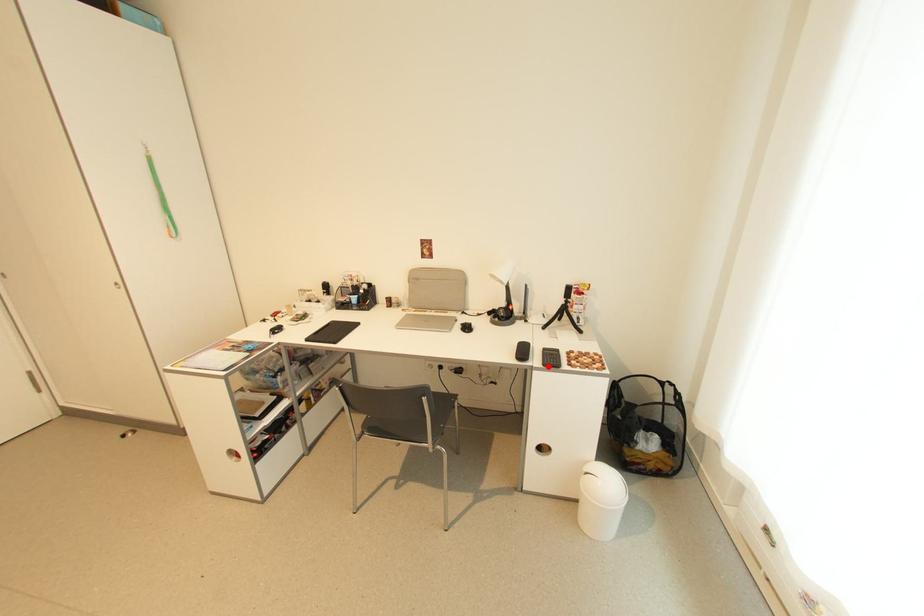
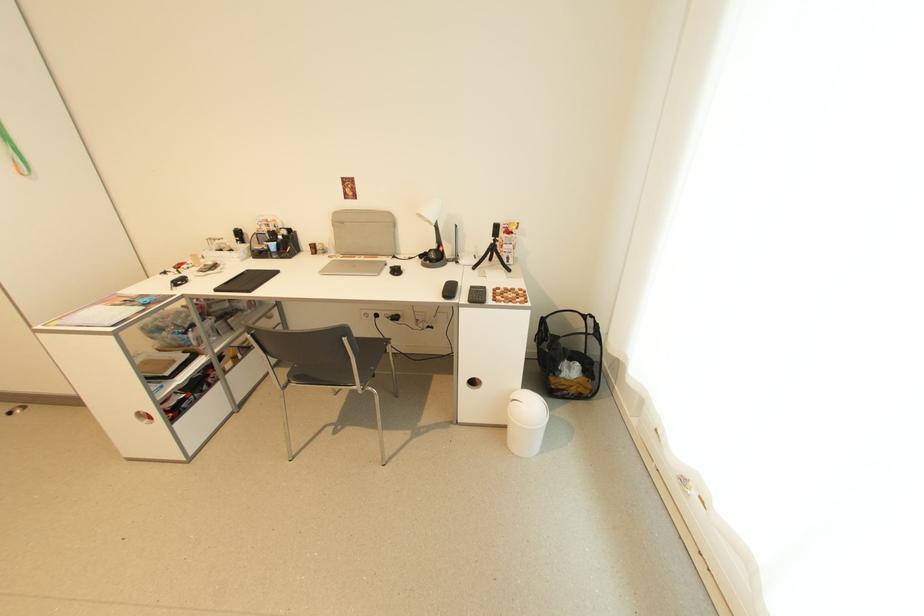
Find the pixel in the second image that matches the highlighted location in the first image.

(473, 302)